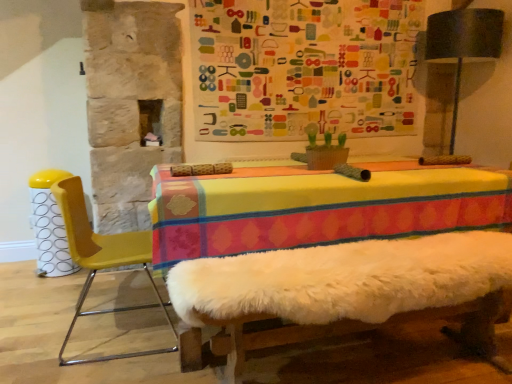
Where is `free space that is to the left of yellow plastic bar stool at left`? This screenshot has width=512, height=384. free space that is to the left of yellow plastic bar stool at left is located at coordinates (15, 273).